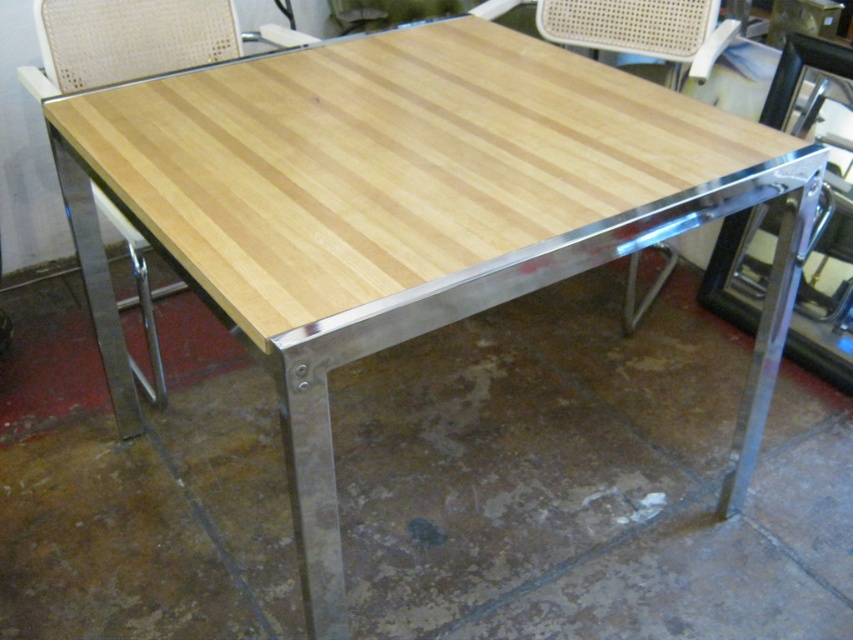
Is woven fabric chair at upper center further to the viewer compared to wooden at center?

No.

Does woven fabric chair at upper center have a greater height compared to wooden at center?

Yes, woven fabric chair at upper center is taller than wooden at center.

Locate an element on the screen. This screenshot has height=640, width=853. woven fabric chair at upper center is located at coordinates (135, 40).

The width and height of the screenshot is (853, 640). In order to click on woven fabric chair at upper center in this screenshot , I will do `click(135, 40)`.

Who is more forward, (694, 16) or (659, 38)?

Point (694, 16) is more forward.

Is wooden at center further to camera compared to woven beige chair at upper center?

Yes, it is behind woven beige chair at upper center.

What do you see at coordinates (641, 29) in the screenshot? I see `wooden at center` at bounding box center [641, 29].

The width and height of the screenshot is (853, 640). Find the location of `wooden at center`. wooden at center is located at coordinates (641, 29).

How far apart are woven fabric chair at upper center and woven beige chair at upper center?

The distance of woven fabric chair at upper center from woven beige chair at upper center is 32.01 inches.

You are a GUI agent. You are given a task and a screenshot of the screen. Output one action in this format:
    pyautogui.click(x=<x>, y=<y>)
    Task: Click on the woven fabric chair at upper center
    
    Given the screenshot: What is the action you would take?
    pyautogui.click(x=135, y=40)

Find the location of a particular element. The height and width of the screenshot is (640, 853). woven fabric chair at upper center is located at coordinates (135, 40).